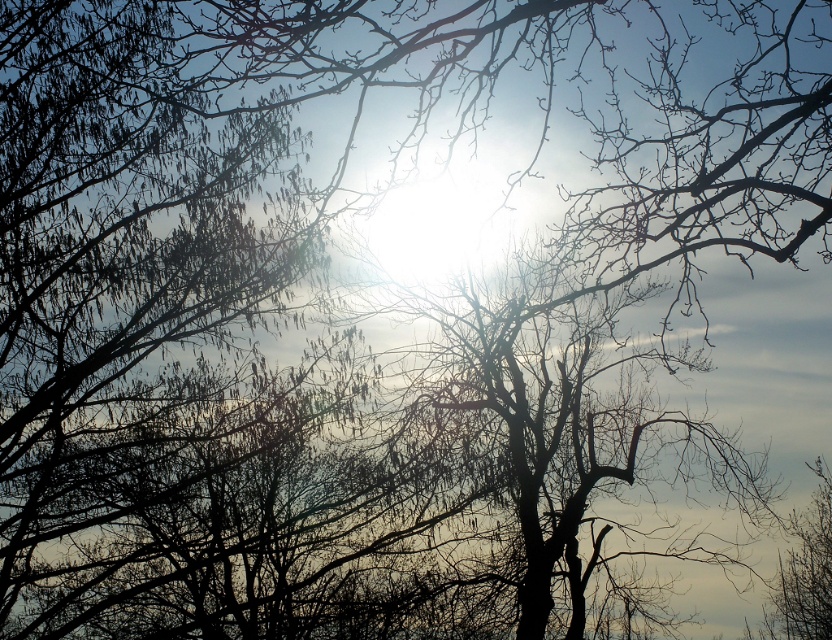
Question: Where is silvery branches at upper left located in relation to black matte tree at center in the image?

Choices:
 (A) right
 (B) left

Answer: (B)

Question: Does silvery branches at upper left appear under black matte tree at center?

Choices:
 (A) yes
 (B) no

Answer: (B)

Question: Which point is farther from the camera taking this photo?

Choices:
 (A) (532, 436)
 (B) (114, 561)

Answer: (A)

Question: Is silvery branches at upper left to the left of black matte tree at center from the viewer's perspective?

Choices:
 (A) yes
 (B) no

Answer: (A)